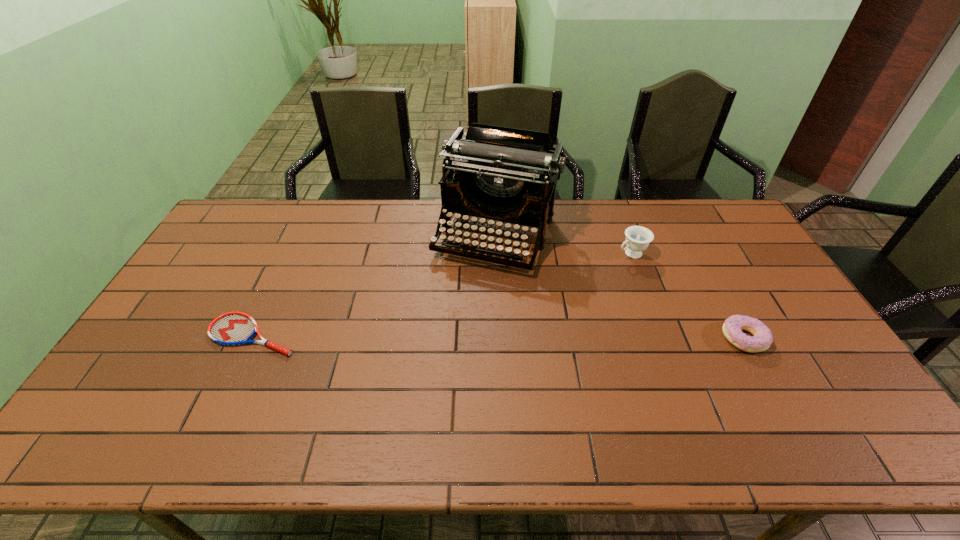
The width and height of the screenshot is (960, 540). Find the location of `tennis racket`. tennis racket is located at coordinates (233, 328).

Identify the location of the leftmost object. The image size is (960, 540). (233, 328).

In order to click on doughnut in this screenshot , I will do `click(762, 338)`.

Locate an element on the screen. the third tallest object is located at coordinates (762, 338).

Where is `the third object from right to left`? The width and height of the screenshot is (960, 540). the third object from right to left is located at coordinates (498, 173).

Where is `typewriter`? The width and height of the screenshot is (960, 540). typewriter is located at coordinates (x=498, y=173).

Find the location of `the second object from right to left`. the second object from right to left is located at coordinates (638, 238).

You are a GUI agent. You are given a task and a screenshot of the screen. Output one action in this format:
    pyautogui.click(x=<x>, y=<y>)
    Task: Click on the second tallest object
    The width and height of the screenshot is (960, 540).
    Given the screenshot: What is the action you would take?
    pyautogui.click(x=638, y=238)

What are the coordinates of `vacant space situated 0.250m on the back of the tennis racket` in the screenshot? It's located at (290, 258).

Find the location of a particular element. free space located 0.300m on the left of the third tallest object is located at coordinates (615, 338).